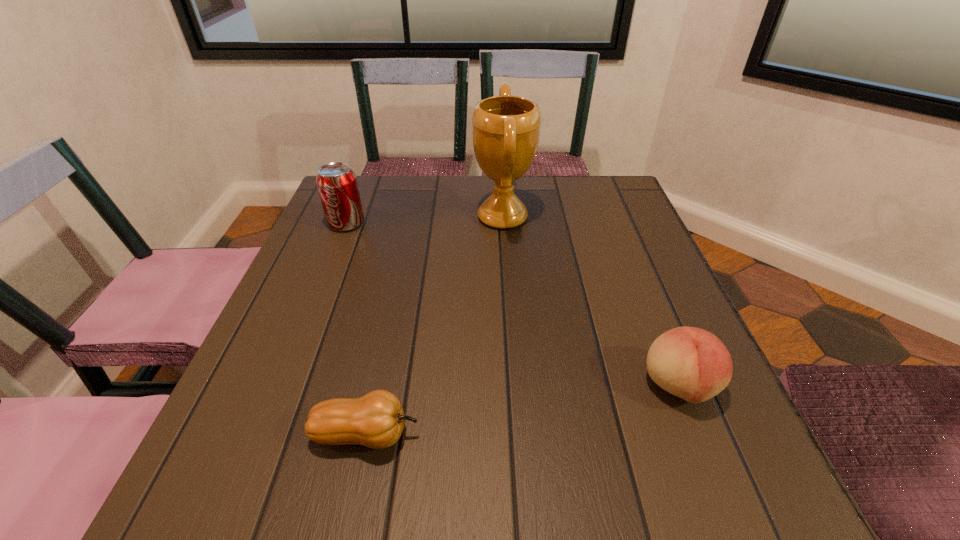
The width and height of the screenshot is (960, 540). Identify the location of object that stands as the closest to the award. (337, 185).

This screenshot has width=960, height=540. I want to click on vacant space that satisfies the following two spatial constraints: 1. on the back side of the rightmost object; 2. on the front of the tallest object with the decoration, so click(x=612, y=217).

The image size is (960, 540). Find the location of `free point that satisfies the following two spatial constraints: 1. on the front of the second object from right to left with the decoration; 2. on the right side of the rightmost object`. free point that satisfies the following two spatial constraints: 1. on the front of the second object from right to left with the decoration; 2. on the right side of the rightmost object is located at coordinates (515, 386).

Image resolution: width=960 pixels, height=540 pixels. Identify the location of blank space that satisfies the following two spatial constraints: 1. on the front of the tallest object with the decoration; 2. on the back side of the peach. (515, 386).

Find the location of a particular element. The height and width of the screenshot is (540, 960). vacant space that satisfies the following two spatial constraints: 1. on the front of the award with the decoration; 2. on the left side of the rightmost object is located at coordinates (515, 386).

In order to click on free spot that satisfies the following two spatial constraints: 1. on the front of the tallest object with the decoration; 2. on the back side of the third tallest object in this screenshot , I will do `click(515, 386)`.

Identify the location of vacant point that satisfies the following two spatial constraints: 1. on the front side of the second shortest object; 2. on the stem side of the shortest object. The height and width of the screenshot is (540, 960). (699, 434).

At what (x,y) coordinates should I click in order to perform the action: click on free space that satisfies the following two spatial constraints: 1. on the front of the third object from left to right with the decoration; 2. on the back side of the second shortest object. Please return your answer as a coordinate pair (x, y). Image resolution: width=960 pixels, height=540 pixels. Looking at the image, I should click on (515, 386).